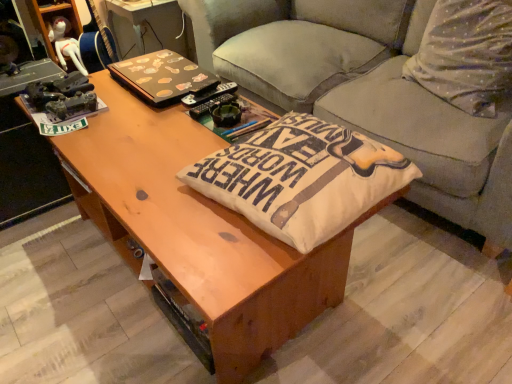
Question: Are beige fabric cushion at center, marked as the first throw pillow in a bottom-to-top arrangement, and gray fabric couch at center located far from each other?

Choices:
 (A) no
 (B) yes

Answer: (A)

Question: Is beige fabric cushion at center, which is the 1th throw pillow from front to back, positioned in front of gray fabric couch at center?

Choices:
 (A) yes
 (B) no

Answer: (A)

Question: Is gray fabric couch at center at the back of beige fabric cushion at center, the second throw pillow viewed from the back?

Choices:
 (A) yes
 (B) no

Answer: (B)

Question: Can you confirm if beige fabric cushion at center, marked as the 2th throw pillow in a top-to-bottom arrangement, is taller than gray fabric couch at center?

Choices:
 (A) no
 (B) yes

Answer: (A)

Question: From a real-world perspective, is beige fabric cushion at center, which is the 1th throw pillow from front to back, beneath gray fabric couch at center?

Choices:
 (A) no
 (B) yes

Answer: (A)

Question: Is beige fabric cushion at center, the second throw pillow viewed from the back, to the left of gray fabric couch at center from the viewer's perspective?

Choices:
 (A) no
 (B) yes

Answer: (B)

Question: Does brown matte laptop at upper center appear on the left side of gray fabric couch at center?

Choices:
 (A) no
 (B) yes

Answer: (B)

Question: Is brown matte laptop at upper center facing away from gray fabric couch at center?

Choices:
 (A) no
 (B) yes

Answer: (B)

Question: From a real-world perspective, does brown matte laptop at upper center sit lower than gray fabric couch at center?

Choices:
 (A) no
 (B) yes

Answer: (A)

Question: Can you confirm if brown matte laptop at upper center is thinner than gray fabric couch at center?

Choices:
 (A) no
 (B) yes

Answer: (B)

Question: Does brown matte laptop at upper center have a greater width compared to gray fabric couch at center?

Choices:
 (A) yes
 (B) no

Answer: (B)

Question: Is brown matte laptop at upper center bigger than gray fabric couch at center?

Choices:
 (A) yes
 (B) no

Answer: (B)

Question: Is gray fabric couch at center positioned beyond the bounds of white cotton pillow at upper right, the first throw pillow viewed from the right?

Choices:
 (A) yes
 (B) no

Answer: (A)